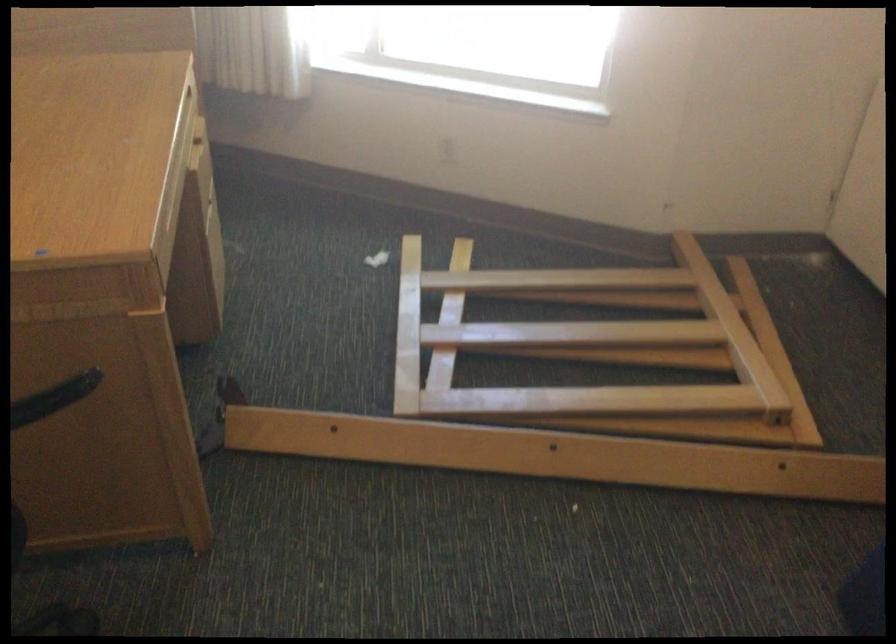
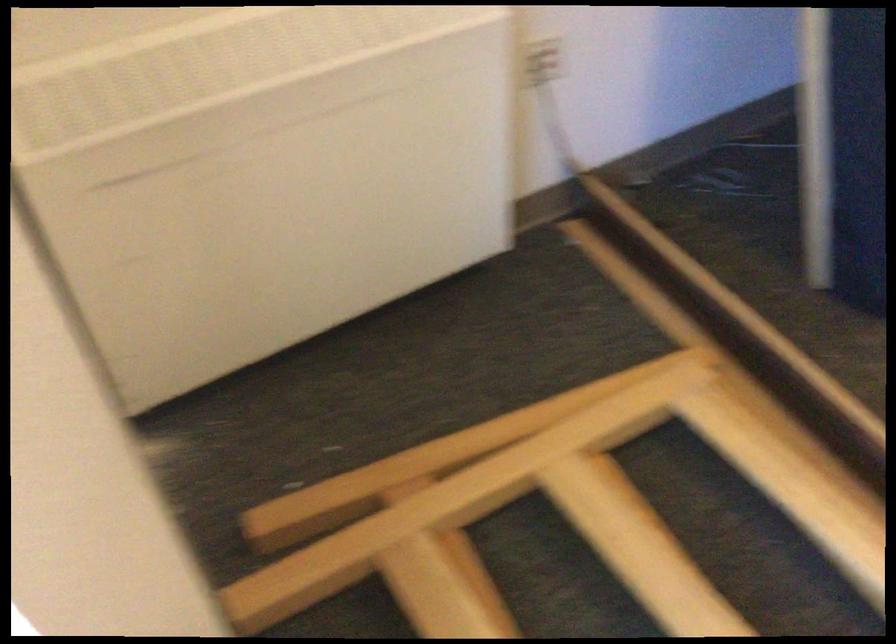
The point at (x=650, y=328) is marked in the first image. Where is the corresponding point in the second image?

(632, 545)